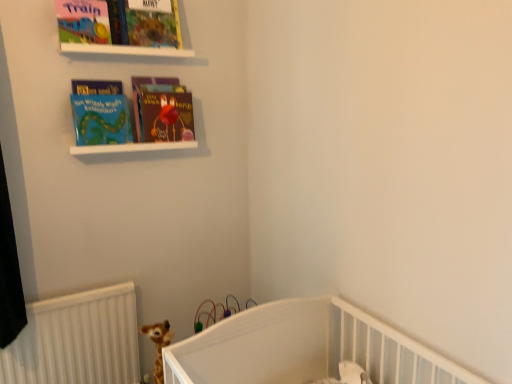
You are a GUI agent. You are given a task and a screenshot of the screen. Output one action in this format:
    pyautogui.click(x=<x>, y=<y>)
    Task: Click on the free point below matte colorful book at upper center, marked as the second book cover in a left-to-right arrangement (from a real-world perspective)
    
    Given the screenshot: What is the action you would take?
    pyautogui.click(x=152, y=45)